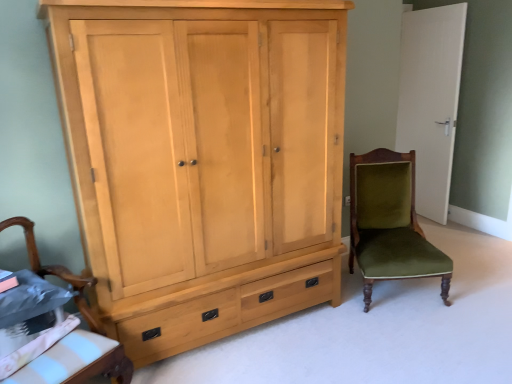
You are a GUI agent. You are given a task and a screenshot of the screen. Output one action in this format:
    pyautogui.click(x=<x>, y=<y>)
    Task: Click on the free space between light wood wardrobe at left and velvet green chair at right, the 1th chair positioned from the back
    Image resolution: width=512 pixels, height=384 pixels.
    Given the screenshot: What is the action you would take?
    pyautogui.click(x=318, y=332)